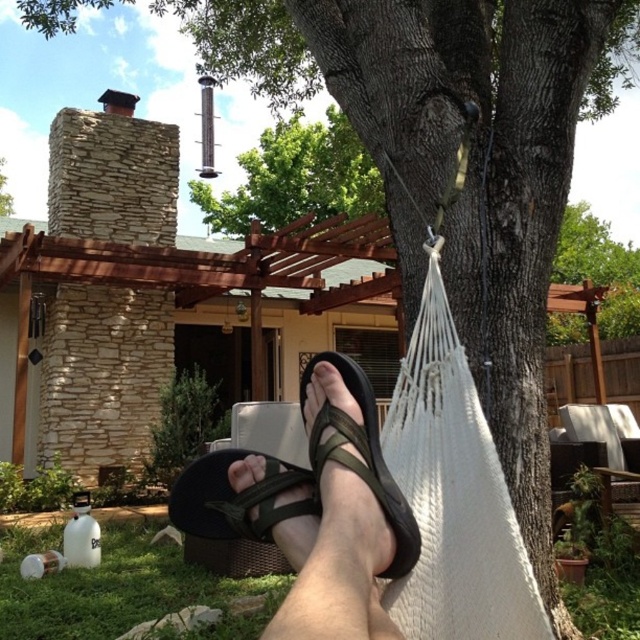
What are the coordinates of the green fabric sandals at center?

The green fabric sandals at center are located at coordinates point (298, 480).

You are standing at the point marked by the coordinates point [324,150] and want to walk towards the point marked by point [586,230]. Given the scene described, will you have an unobstructed path? Please explain your reasoning based on the spatial relationships provided.

Since point [324,150] is in front of point [586,230], you would be walking towards a location that is behind your current position. This means your path would require moving backward, which is physically impossible without turning around. Additionally, the scene includes structures like the wooden pergola and fireplace that might block direct backward movement.